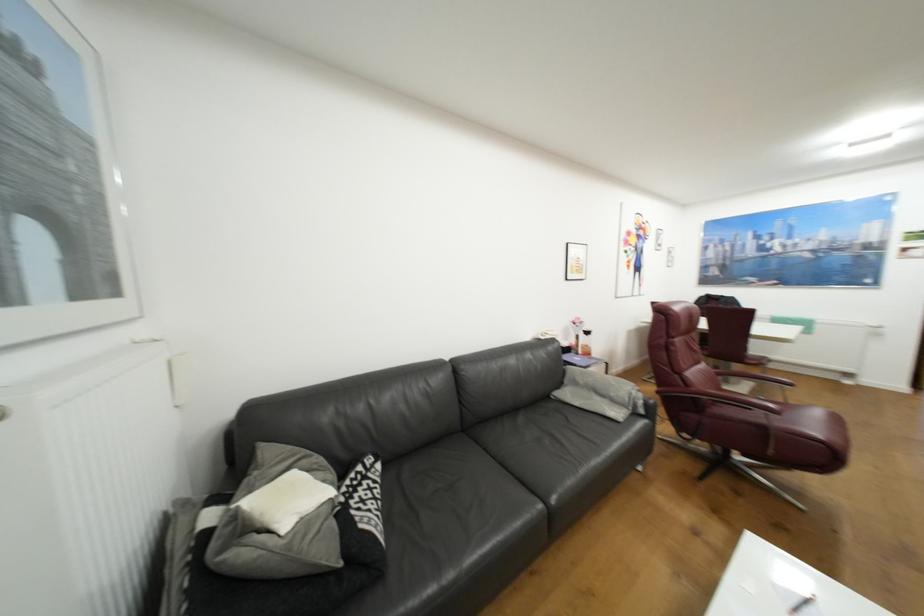
Describe the element at coordinates (721, 398) in the screenshot. I see `the red chair armrest` at that location.